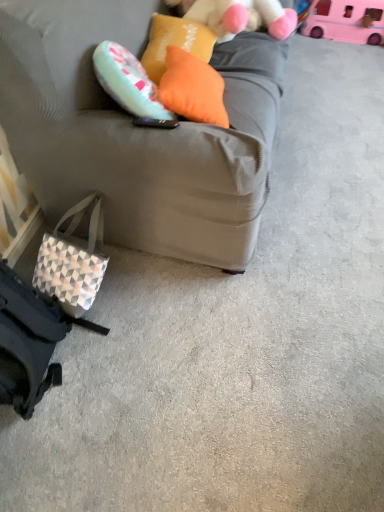
Question: Can you confirm if matte gray couch at center is smaller than pink plastic toy at upper right?

Choices:
 (A) yes
 (B) no

Answer: (B)

Question: Considering the relative sizes of matte gray couch at center and pink plastic toy at upper right in the image provided, is matte gray couch at center bigger than pink plastic toy at upper right?

Choices:
 (A) yes
 (B) no

Answer: (A)

Question: Considering the relative positions of matte gray couch at center and pink plastic toy at upper right in the image provided, is matte gray couch at center in front of pink plastic toy at upper right?

Choices:
 (A) no
 (B) yes

Answer: (B)

Question: Is matte gray couch at center shorter than pink plastic toy at upper right?

Choices:
 (A) no
 (B) yes

Answer: (A)

Question: From the image's perspective, is matte gray couch at center above pink plastic toy at upper right?

Choices:
 (A) yes
 (B) no

Answer: (B)

Question: From a real-world perspective, is fluffy white teddy bear at upper center physically located above or below geometric-patterned fabric pouch at lower left?

Choices:
 (A) below
 (B) above

Answer: (B)

Question: Is fluffy white teddy bear at upper center to the left or to the right of geometric-patterned fabric pouch at lower left in the image?

Choices:
 (A) right
 (B) left

Answer: (A)

Question: Choose the correct answer: Is fluffy white teddy bear at upper center inside geometric-patterned fabric pouch at lower left or outside it?

Choices:
 (A) inside
 (B) outside

Answer: (B)

Question: Considering the positions of point (223, 36) and point (44, 270), is point (223, 36) closer or farther from the camera than point (44, 270)?

Choices:
 (A) farther
 (B) closer

Answer: (A)

Question: Is pink plastic toy at upper right wider or thinner than geometric-patterned fabric pouch at lower left?

Choices:
 (A) thin
 (B) wide

Answer: (A)

Question: From a real-world perspective, is pink plastic toy at upper right physically located above or below geometric-patterned fabric pouch at lower left?

Choices:
 (A) above
 (B) below

Answer: (B)

Question: From the image's perspective, is pink plastic toy at upper right above or below geometric-patterned fabric pouch at lower left?

Choices:
 (A) below
 (B) above

Answer: (B)

Question: Does point (359, 27) appear closer or farther from the camera than point (82, 260)?

Choices:
 (A) farther
 (B) closer

Answer: (A)

Question: Is orange fabric pillow at upper center, the first pillow viewed from the back, taller or shorter than fluffy white teddy bear at upper center?

Choices:
 (A) short
 (B) tall

Answer: (A)

Question: Is orange fabric pillow at upper center, the first pillow viewed from the back, inside the boundaries of fluffy white teddy bear at upper center, or outside?

Choices:
 (A) outside
 (B) inside

Answer: (A)